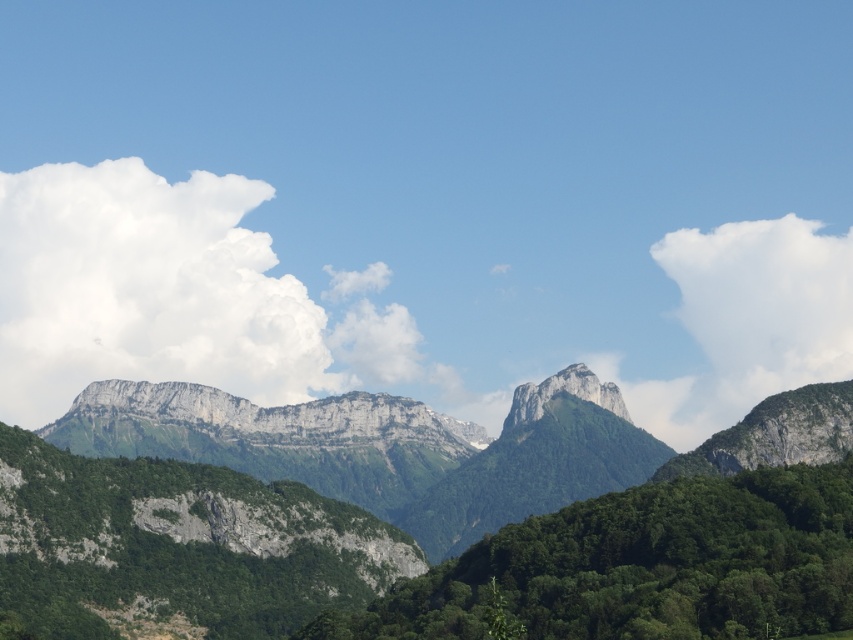
Question: Among these points, which one is farthest from the camera?

Choices:
 (A) (544, 563)
 (B) (80, 460)

Answer: (B)

Question: Does green rocky mountain at center come in front of white fluffy cloud at upper left?

Choices:
 (A) yes
 (B) no

Answer: (A)

Question: Which object appears farthest from the camera in this image?

Choices:
 (A) white fluffy cloud at upper left
 (B) green leafy forest at center
 (C) white fluffy cloud at upper right

Answer: (C)

Question: Which of the following is the farthest from the observer?

Choices:
 (A) (247, 336)
 (B) (477, 563)
 (C) (811, 518)

Answer: (A)

Question: In this image, where is green leafy forest at center located relative to white fluffy cloud at upper right?

Choices:
 (A) right
 (B) left

Answer: (B)

Question: Is green rocky mountain at center thinner than green leafy forest at center?

Choices:
 (A) yes
 (B) no

Answer: (B)